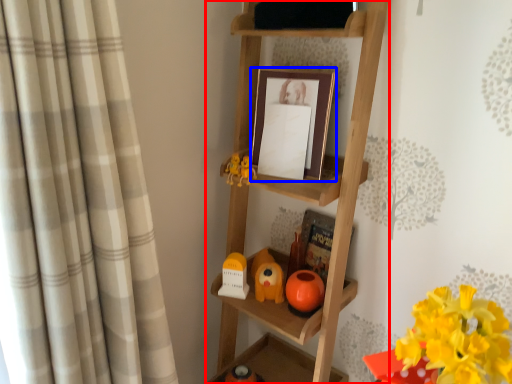
Question: Which object appears closest to the camera in this image, shelf (highlighted by a red box) or picture frame (highlighted by a blue box)?

Choices:
 (A) shelf
 (B) picture frame

Answer: (A)